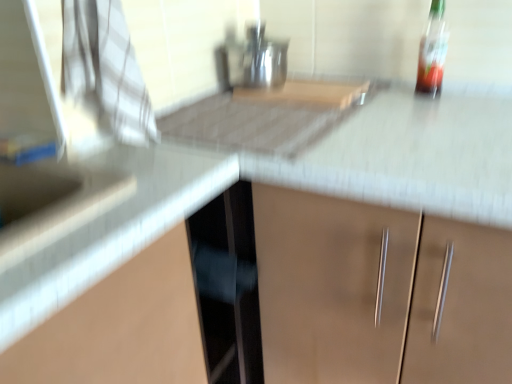
Question: From a real-world perspective, is white glossy counter top at upper left positioned under translucent glass bottle at upper right based on gravity?

Choices:
 (A) no
 (B) yes

Answer: (B)

Question: Is white glossy counter top at upper left far away from translucent glass bottle at upper right?

Choices:
 (A) no
 (B) yes

Answer: (A)

Question: Is the position of white glossy counter top at upper left less distant than that of translucent glass bottle at upper right?

Choices:
 (A) yes
 (B) no

Answer: (A)

Question: Could you tell me if white glossy counter top at upper left is turned towards translucent glass bottle at upper right?

Choices:
 (A) no
 (B) yes

Answer: (A)

Question: From a real-world perspective, does white glossy counter top at upper left stand above translucent glass bottle at upper right?

Choices:
 (A) yes
 (B) no

Answer: (B)

Question: Is white glossy counter top at upper left at the left side of translucent glass bottle at upper right?

Choices:
 (A) yes
 (B) no

Answer: (A)

Question: Is translucent glass bottle at upper right positioned before white glossy counter top at upper left?

Choices:
 (A) yes
 (B) no

Answer: (B)

Question: Does translucent glass bottle at upper right have a greater height compared to white glossy counter top at upper left?

Choices:
 (A) no
 (B) yes

Answer: (B)

Question: Are translucent glass bottle at upper right and white glossy counter top at upper left far apart?

Choices:
 (A) no
 (B) yes

Answer: (A)

Question: From a real-world perspective, is translucent glass bottle at upper right on white glossy counter top at upper left?

Choices:
 (A) yes
 (B) no

Answer: (A)

Question: Considering the relative sizes of translucent glass bottle at upper right and white glossy counter top at upper left in the image provided, is translucent glass bottle at upper right thinner than white glossy counter top at upper left?

Choices:
 (A) no
 (B) yes

Answer: (B)

Question: Does translucent glass bottle at upper right appear on the right side of white glossy counter top at upper left?

Choices:
 (A) no
 (B) yes

Answer: (B)

Question: From the image's perspective, relative to translucent glass bottle at upper right, is white glossy counter top at upper left above or below?

Choices:
 (A) below
 (B) above

Answer: (A)